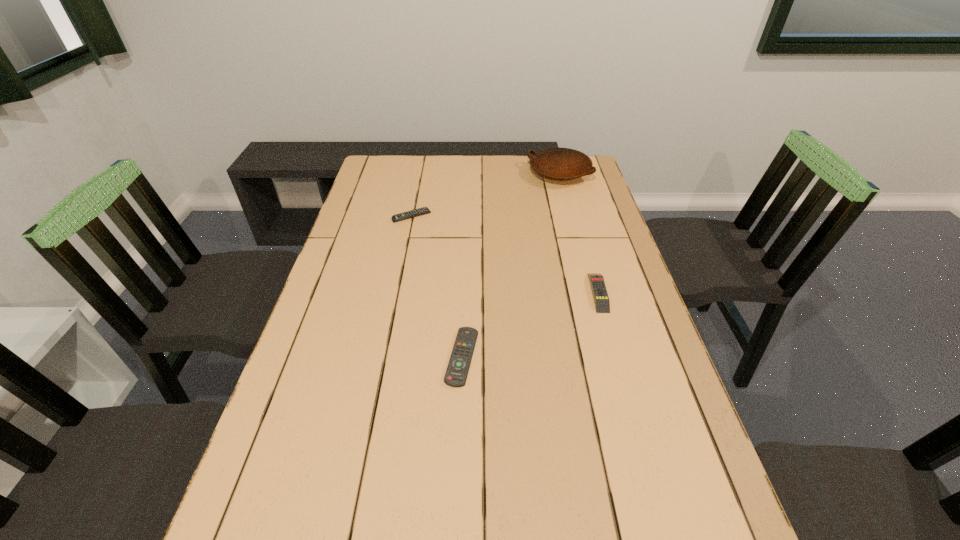
The width and height of the screenshot is (960, 540). Find the location of `plate`. plate is located at coordinates (556, 163).

At what (x,y) coordinates should I click in order to perform the action: click on the farthest object. Please return your answer as a coordinate pair (x, y). This screenshot has height=540, width=960. Looking at the image, I should click on (556, 163).

Identify the location of the second nearest object. The image size is (960, 540). (602, 304).

At what (x,y) coordinates should I click in order to perform the action: click on the rightmost remote control. Please return your answer as a coordinate pair (x, y). Looking at the image, I should click on (602, 304).

Where is `the farthest remote control`? the farthest remote control is located at coordinates coord(424,210).

Image resolution: width=960 pixels, height=540 pixels. Find the location of `the leftmost remote control`. the leftmost remote control is located at coordinates (424, 210).

Find the location of `the nearest object`. the nearest object is located at coordinates (456, 374).

Identify the location of the second object from left to right. (456, 374).

Where is `free region located on the left of the farthest object`? This screenshot has width=960, height=540. free region located on the left of the farthest object is located at coordinates (431, 173).

Find the location of a particular element. Image resolution: width=960 pixels, height=540 pixels. vacant space located 0.060m on the back of the second tallest object is located at coordinates (588, 260).